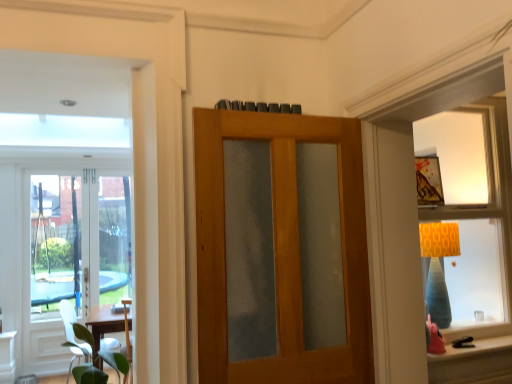
Question: Looking at the image, does clear glass door at left, arranged as the second door when viewed from the right, seem bigger or smaller compared to white matte chair at lower left?

Choices:
 (A) big
 (B) small

Answer: (B)

Question: Based on their positions, is clear glass door at left, which ranks as the 2th door in front-to-back order, located to the left or right of white matte chair at lower left?

Choices:
 (A) left
 (B) right

Answer: (A)

Question: Which object is the closest to the matte orange lampshade at upper right?

Choices:
 (A) wooden door with frosted glass at center, positioned as the 2th door in left-to-right order
 (B) clear glass door at left, the 1th door from the back
 (C) matte orange lampshade at lower right
 (D) white matte chair at lower left

Answer: (C)

Question: Estimate the real-world distances between objects in this image. Which object is closer to the wooden door with frosted glass at center, the first door positioned from the right?

Choices:
 (A) clear glass door at left, which ranks as the 1th door in left-to-right order
 (B) matte orange lampshade at lower right
 (C) white matte chair at lower left
 (D) matte orange lampshade at upper right

Answer: (B)